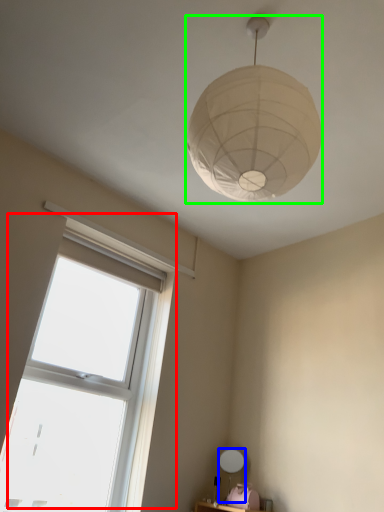
Question: Which object is positioned farthest from window (highlighted by a red box)? Select from table lamp (highlighted by a blue box) and lamp (highlighted by a green box).

Choices:
 (A) table lamp
 (B) lamp

Answer: (B)